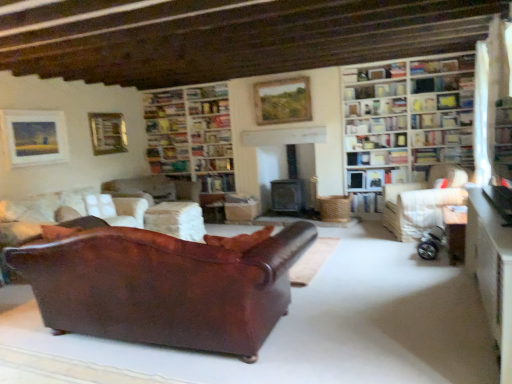
Image resolution: width=512 pixels, height=384 pixels. Identify the location of silver metallic baby carriage at lower right. (431, 243).

In order to face wooden table at lower right, the 2th table viewed from the right, should I rotate leftwards or rightwards?

Rotate your view right by about 30.440°.

Locate an element on the screen. The width and height of the screenshot is (512, 384). hardcover book at upper right, the 5th book when ordered from left to right is located at coordinates (376, 125).

What is the approximate width of hardcover book at upper right, placed as the first book when sorted from top to bottom?

hardcover book at upper right, placed as the first book when sorted from top to bottom, is 15.70 centimeters in width.

Where is `white wooden bookcase at upper right, the 1th bookcase viewed from the front`? The width and height of the screenshot is (512, 384). white wooden bookcase at upper right, the 1th bookcase viewed from the front is located at coordinates (406, 119).

Identify the location of matte gold picture frame at upper left, placed as the 1th picture frame when sorted from front to back. The height and width of the screenshot is (384, 512). (36, 137).

Identify the location of wooden table at lower right, which is the 2th table from back to front. This screenshot has height=384, width=512. (455, 232).

I want to click on silver metallic baby carriage at lower right, so click(431, 243).

From a real-world perspective, is white fabric curtain at upper right positioned under wooden bookshelf at center, the first bookcase when ordered from left to right, based on gravity?

Actually, white fabric curtain at upper right is physically above wooden bookshelf at center, the first bookcase when ordered from left to right, in the real world.

Between white fabric curtain at upper right and wooden bookshelf at center, which ranks as the 2th bookcase in front-to-back order, which one has smaller size?

white fabric curtain at upper right is smaller.

How distant is white fabric curtain at upper right from wooden bookshelf at center, arranged as the second bookcase when viewed from the right?

3.94 meters.

What's the angular difference between white fabric curtain at upper right and wooden bookshelf at center, which ranks as the 2th bookcase in front-to-back order,'s facing directions?

The angular difference between white fabric curtain at upper right and wooden bookshelf at center, which ranks as the 2th bookcase in front-to-back order, is 92.5 degrees.

From the image's perspective, between leather couch at center, marked as the second studio couch in a right-to-left arrangement, and wooden table at lower right, the 2th table viewed from the right, which one is located above?

wooden table at lower right, the 2th table viewed from the right.

Is point (211, 274) closer or farther from the camera than point (504, 247)?

Point (211, 274).

Between leather couch at center, marked as the second studio couch in a right-to-left arrangement, and wooden table at lower right, marked as the first table in a front-to-back arrangement, which one appears on the right side from the viewer's perspective?

Positioned to the right is wooden table at lower right, marked as the first table in a front-to-back arrangement.

Measure the distance between leather couch at center, marked as the second studio couch in a right-to-left arrangement, and wooden table at lower right, the 3th table in the back-to-front sequence.

leather couch at center, marked as the second studio couch in a right-to-left arrangement, and wooden table at lower right, the 3th table in the back-to-front sequence, are 6.15 feet apart.

Can we say wooden bookshelf at upper right, which is the 4th shelf in left-to-right order, lies outside hardcover book at center, marked as the third book in a right-to-left arrangement?

wooden bookshelf at upper right, which is the 4th shelf in left-to-right order, lies outside hardcover book at center, marked as the third book in a right-to-left arrangement,'s area.

From a real-world perspective, who is located lower, wooden bookshelf at upper right, the 6th shelf from the bottom, or hardcover book at center, which is the 4th book in bottom-to-top order?

hardcover book at center, which is the 4th book in bottom-to-top order.

From the image's perspective, is wooden bookshelf at upper right, the first shelf viewed from the top, located beneath hardcover book at center, marked as the third book in a right-to-left arrangement?

Actually, wooden bookshelf at upper right, the first shelf viewed from the top, appears above hardcover book at center, marked as the third book in a right-to-left arrangement, in the image.

Which object is positioned more to the left, wooden bookshelf at upper right, which is the 3th shelf from right to left, or hardcover book at center, the second book from the top?

hardcover book at center, the second book from the top.

Is wooden bookshelf at upper right, the 6th shelf from the bottom, positioned before wooden table at lower right, the 2th table viewed from the right?

No, wooden bookshelf at upper right, the 6th shelf from the bottom, is behind wooden table at lower right, the 2th table viewed from the right.

How far apart are wooden bookshelf at upper right, the 6th shelf from the bottom, and wooden table at lower right, the 2th table viewed from the right?

They are 2.84 meters apart.

I want to click on the 2nd table in front of the wooden bookshelf at upper right, the 6th shelf from the bottom, so click(490, 271).

Based on the photo, does wooden bookshelf at upper right, the first shelf viewed from the top, have a larger size compared to wooden table at lower right, the 3th table in the back-to-front sequence?

Actually, wooden bookshelf at upper right, the first shelf viewed from the top, might be smaller than wooden table at lower right, the 3th table in the back-to-front sequence.

Looking at this image, measure the distance from leather couch at lower left, placed as the first studio couch when sorted from left to right, to matte oil painting at upper center, the 2th picture frame from the front.

The distance of leather couch at lower left, placed as the first studio couch when sorted from left to right, from matte oil painting at upper center, the 2th picture frame from the front, is 8.30 feet.

Who is bigger, leather couch at lower left, placed as the 3th studio couch when sorted from right to left, or matte oil painting at upper center, which is counted as the second picture frame, starting from the back?

Bigger between the two is leather couch at lower left, placed as the 3th studio couch when sorted from right to left.

Consider the image. Can you confirm if leather couch at lower left, placed as the first studio couch when sorted from left to right, is wider than matte oil painting at upper center, the 3th picture frame from the left?

Yes, leather couch at lower left, placed as the first studio couch when sorted from left to right, is wider than matte oil painting at upper center, the 3th picture frame from the left.

Which object is further away from the camera taking this photo, leather couch at lower left, placed as the first studio couch when sorted from left to right, or matte oil painting at upper center, which is counted as the first picture frame, starting from the right?

matte oil painting at upper center, which is counted as the first picture frame, starting from the right, is further away from the camera.

Would you say matte gold picture frame at upper left, placed as the 1th picture frame when sorted from front to back, is outside hardcover book at upper right, the 5th book when ordered from left to right?

Yes.

From a real-world perspective, between matte gold picture frame at upper left, which is counted as the 3th picture frame, starting from the right, and hardcover book at upper right, the 5th book when ordered from left to right, who is vertically lower?

hardcover book at upper right, the 5th book when ordered from left to right, is physically lower.

How much distance is there between matte gold picture frame at upper left, which is counted as the 3th picture frame, starting from the right, and hardcover book at upper right, which is counted as the 1th book, starting from the right?

The distance of matte gold picture frame at upper left, which is counted as the 3th picture frame, starting from the right, from hardcover book at upper right, which is counted as the 1th book, starting from the right, is 4.46 meters.

The image size is (512, 384). What are the coordinates of `the 1st picture frame above the hardcover book at upper right, which is counted as the 1th book, starting from the right (from a real-world perspective)` in the screenshot? It's located at (36, 137).

Is matte gold picture frame at upper left, placed as the 1th picture frame when sorted from front to back, to the left of wooden bookshelf at upper right, which is the 3th shelf from right to left, from the viewer's perspective?

Yes, matte gold picture frame at upper left, placed as the 1th picture frame when sorted from front to back, is to the left of wooden bookshelf at upper right, which is the 3th shelf from right to left.

From the image's perspective, which one is positioned lower, matte gold picture frame at upper left, the 1th picture frame when ordered from left to right, or wooden bookshelf at upper right, which is the 3th shelf from right to left?

matte gold picture frame at upper left, the 1th picture frame when ordered from left to right, appears lower in the image.

Is matte gold picture frame at upper left, the 1th picture frame when ordered from left to right, turned away from wooden bookshelf at upper right, which is the 4th shelf in left-to-right order?

No, matte gold picture frame at upper left, the 1th picture frame when ordered from left to right, is not facing the opposite direction of wooden bookshelf at upper right, which is the 4th shelf in left-to-right order.

From a real-world perspective, count 2nd shelfs upward from the matte gold picture frame at upper left, which is the third picture frame from back to front, and point to it. Please provide its 2D coordinates.

[(442, 83)]

The height and width of the screenshot is (384, 512). There is a wooden bookshelf at center, which ranks as the 2th bookcase in front-to-back order. Identify the location of curtain above it (from a real-world perspective). (x=481, y=116).

I want to click on studio couch below the wooden table at lower right, the 2th table viewed from the right (from the image's perspective), so click(163, 287).

Based on the photo, based on their spatial positions, is wooden bookshelf at upper right, which is the 2th shelf in top-to-bottom order, or wooden bookshelf at upper right, the first shelf viewed from the top, further from white fabric curtain at upper right?

Based on the image, wooden bookshelf at upper right, which is the 2th shelf in top-to-bottom order, appears to be further to white fabric curtain at upper right.

When comparing their distances from wooden bookshelf at center, the 5th shelf positioned from the top, does wooden table at lower right, which appears as the second table when viewed from the front, or white wooden bookcase at upper right, the first bookcase from the right, seem closer?

white wooden bookcase at upper right, the first bookcase from the right.

From the image, which object appears to be nearer to white fabric couch at right, the 1th studio couch positioned from the right, hardcover book at center, positioned as the 5th book in right-to-left order, or wooden bookshelf at upper right, the first shelf viewed from the top?

Based on the image, wooden bookshelf at upper right, the first shelf viewed from the top, appears to be nearer to white fabric couch at right, the 1th studio couch positioned from the right.

Based on the photo, when comparing their distances from wooden bookshelf at upper right, placed as the 5th shelf when sorted from right to left, does wooden bookshelf at center, the first bookcase from the back, or wooden bookshelf at center, acting as the second shelf starting from the bottom, seem closer?

The object closer to wooden bookshelf at upper right, placed as the 5th shelf when sorted from right to left, is wooden bookshelf at center, acting as the second shelf starting from the bottom.

Considering their positions, is matte oil painting at upper center, the 3th picture frame from the left, positioned further to white fabric couch at right, the 1th studio couch positioned from the right, than wooden table at lower right, the 1th table in the right-to-left sequence?

matte oil painting at upper center, the 3th picture frame from the left, is positioned further to the anchor white fabric couch at right, the 1th studio couch positioned from the right.

When comparing their distances from hardcover book at center, which is the 3th book in left-to-right order, does wooden bookshelf at upper right, which is the 4th shelf in left-to-right order, or leather couch at lower left, placed as the 3th studio couch when sorted from right to left, seem further?

Based on the image, wooden bookshelf at upper right, which is the 4th shelf in left-to-right order, appears to be further to hardcover book at center, which is the 3th book in left-to-right order.

Based on the photo, based on their spatial positions, is matte oil painting at upper center, the 3th picture frame from the left, or matte gold picture frame at upper left, the 1th picture frame when ordered from left to right, closer to hardcover book at upper right, which is counted as the 1th book, starting from the right?

matte oil painting at upper center, the 3th picture frame from the left.

From the image, which object appears to be farther from white fabric curtain at upper right, wooden bookshelf at upper right, placed as the 5th shelf when sorted from left to right, or wooden table at lower right, the 3th table in the back-to-front sequence?

Among the two, wooden table at lower right, the 3th table in the back-to-front sequence, is located further to white fabric curtain at upper right.

Locate an element on the screen. studio couch between wooden bookshelf at center, acting as the second shelf starting from the bottom, and wooden bookshelf at upper right, the fourth shelf from the bottom, in the horizontal direction is located at coordinates (422, 202).

The width and height of the screenshot is (512, 384). What are the coordinates of `shelf situated between metallic gold picture frame at upper left, arranged as the 3th picture frame when viewed from the front, and matte oil painting at upper center, the 2th picture frame from the front, from left to right` in the screenshot? It's located at (213, 164).

The width and height of the screenshot is (512, 384). I want to click on shelf situated between wooden bookshelf at center, which ranks as the 2th bookcase in front-to-back order, and wooden bookshelf at upper right, acting as the 5th shelf starting from the bottom, from left to right, so click(213, 164).

The image size is (512, 384). I want to click on picture frame between hardcover book at center, which appears as the 2th book when ordered from the bottom, and wooden bookshelf at upper right, the 6th shelf from the bottom, from left to right, so click(x=283, y=101).